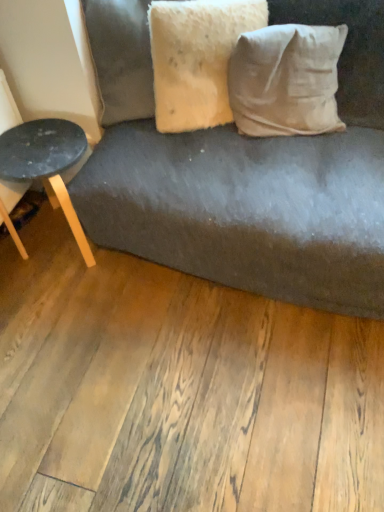
Question: Should I look upward or downward to see white cotton pillow at upper right, the 2th pillow when ordered from left to right?

Choices:
 (A) up
 (B) down

Answer: (A)

Question: Does matte black stool at left contain white cotton pillow at upper right, the 2th pillow when ordered from left to right?

Choices:
 (A) no
 (B) yes

Answer: (A)

Question: Does matte black stool at left turn towards white cotton pillow at upper right, the 2th pillow when ordered from left to right?

Choices:
 (A) no
 (B) yes

Answer: (A)

Question: From a real-world perspective, is matte black stool at left beneath white cotton pillow at upper right, the 2th pillow when ordered from left to right?

Choices:
 (A) yes
 (B) no

Answer: (A)

Question: From the image's perspective, is matte black stool at left located beneath white cotton pillow at upper right, the 2th pillow when ordered from left to right?

Choices:
 (A) no
 (B) yes

Answer: (B)

Question: Can you confirm if matte black stool at left is thinner than white cotton pillow at upper right, which ranks as the 1th pillow in right-to-left order?

Choices:
 (A) no
 (B) yes

Answer: (A)

Question: Is white cotton pillow at upper right, the 2th pillow when ordered from left to right, at the back of matte black stool at left?

Choices:
 (A) no
 (B) yes

Answer: (A)

Question: Can you confirm if white cotton pillow at upper right, which ranks as the 1th pillow in right-to-left order, is smaller than matte black stool at left?

Choices:
 (A) yes
 (B) no

Answer: (A)

Question: Does white cotton pillow at upper right, which ranks as the 1th pillow in right-to-left order, lie behind matte black stool at left?

Choices:
 (A) yes
 (B) no

Answer: (B)

Question: From a real-world perspective, is white cotton pillow at upper right, which ranks as the 1th pillow in right-to-left order, positioned over matte black stool at left based on gravity?

Choices:
 (A) no
 (B) yes

Answer: (B)

Question: Would you say white cotton pillow at upper right, which ranks as the 1th pillow in right-to-left order, contains matte black stool at left?

Choices:
 (A) no
 (B) yes

Answer: (A)

Question: Is white cotton pillow at upper right, which ranks as the 1th pillow in right-to-left order, thinner than matte black stool at left?

Choices:
 (A) no
 (B) yes

Answer: (B)

Question: Does white cotton pillow at upper right, the 2th pillow when ordered from left to right, have a greater width compared to matte black stool at left?

Choices:
 (A) no
 (B) yes

Answer: (A)

Question: From a real-world perspective, is white cotton pillow at upper right, the 2th pillow when ordered from left to right, positioned under fuzzy beige pillow at upper center, the first pillow from the left, based on gravity?

Choices:
 (A) no
 (B) yes

Answer: (B)